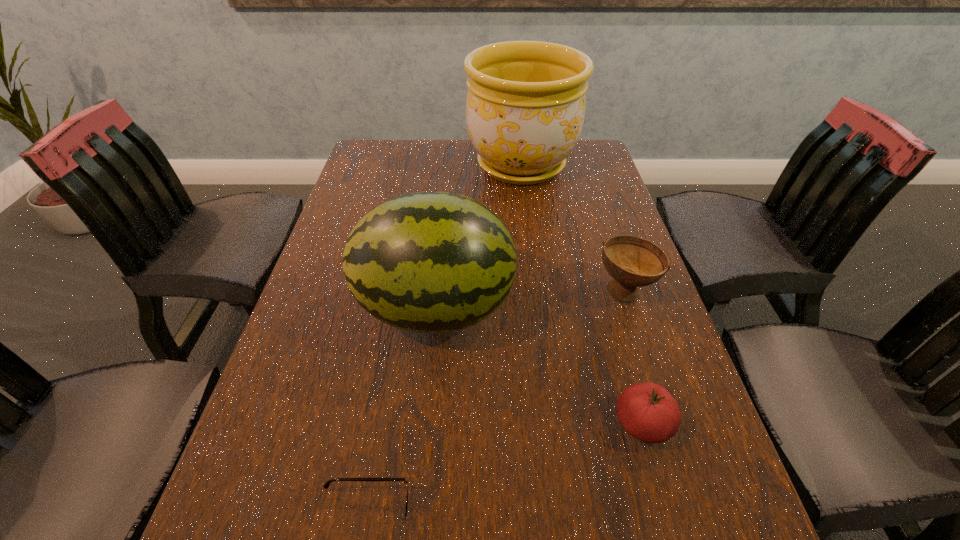
The width and height of the screenshot is (960, 540). I want to click on the farthest object, so click(525, 108).

I want to click on the fourth shortest object, so click(x=427, y=262).

Where is `soup bowl`? The height and width of the screenshot is (540, 960). soup bowl is located at coordinates click(633, 262).

The height and width of the screenshot is (540, 960). I want to click on the fourth farthest object, so click(x=647, y=411).

The image size is (960, 540). Identify the location of the fourth tallest object. (647, 411).

Find the location of `vacant space situated 0.390m on the front of the flowerpot`. vacant space situated 0.390m on the front of the flowerpot is located at coordinates (538, 294).

The height and width of the screenshot is (540, 960). I want to click on vacant space situated 0.250m at the stem end of the second tallest object, so click(629, 309).

You are a GUI agent. You are given a task and a screenshot of the screen. Output one action in this format:
    pyautogui.click(x=<x>, y=<y>)
    Task: Click on the vacant space located on the front of the third tallest object
    
    Given the screenshot: What is the action you would take?
    pyautogui.click(x=699, y=516)

The width and height of the screenshot is (960, 540). Find the location of `free space located 0.080m on the left of the second shortest object`. free space located 0.080m on the left of the second shortest object is located at coordinates (566, 424).

Where is `object situated at the far edge`? object situated at the far edge is located at coordinates (525, 108).